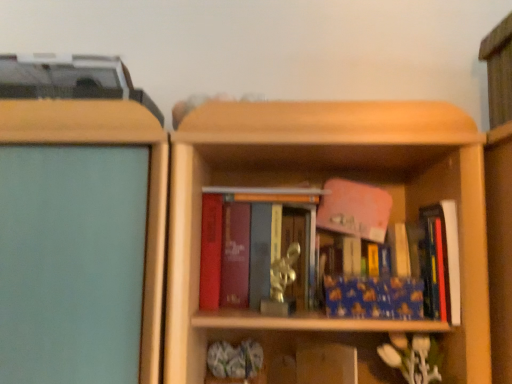
Question: Is blue matte book at center, the 2th book positioned from the left, far away from matte red book at center, which is the first book in left-to-right order?

Choices:
 (A) yes
 (B) no

Answer: (B)

Question: Is blue matte book at center, the 2th book positioned from the left, wider than matte red book at center, which is the first book in left-to-right order?

Choices:
 (A) no
 (B) yes

Answer: (A)

Question: Does blue matte book at center, which appears as the second book when viewed from the right, appear on the right side of matte red book at center, which is counted as the 3th book, starting from the right?

Choices:
 (A) yes
 (B) no

Answer: (A)

Question: From a real-world perspective, is blue matte book at center, the 2th book positioned from the left, below matte red book at center, which is counted as the 3th book, starting from the right?

Choices:
 (A) yes
 (B) no

Answer: (A)

Question: Is blue matte book at center, the 2th book positioned from the left, next to matte red book at center, which is the first book in left-to-right order, and touching it?

Choices:
 (A) no
 (B) yes

Answer: (A)

Question: From a real-world perspective, is matte red book at center, which is the first book in left-to-right order, above or below blue matte book at right, marked as the 1th book in a right-to-left arrangement?

Choices:
 (A) below
 (B) above

Answer: (B)

Question: Looking at the image, does matte red book at center, which is the first book in left-to-right order, seem bigger or smaller compared to blue matte book at right, the third book in the left-to-right sequence?

Choices:
 (A) big
 (B) small

Answer: (A)

Question: Does point (233, 243) appear closer or farther from the camera than point (455, 248)?

Choices:
 (A) farther
 (B) closer

Answer: (A)

Question: From the image's perspective, is matte red book at center, which is counted as the 3th book, starting from the right, positioned above or below blue matte book at right, marked as the 1th book in a right-to-left arrangement?

Choices:
 (A) above
 (B) below

Answer: (A)

Question: Is matte red book at center, which is counted as the 3th book, starting from the right, wider or thinner than blue matte book at center, which appears as the second book when viewed from the right?

Choices:
 (A) thin
 (B) wide

Answer: (B)

Question: Choose the correct answer: Is matte red book at center, which is counted as the 3th book, starting from the right, inside blue matte book at center, the 2th book positioned from the left, or outside it?

Choices:
 (A) outside
 (B) inside

Answer: (A)

Question: In terms of height, does matte red book at center, which is counted as the 3th book, starting from the right, look taller or shorter compared to blue matte book at center, which appears as the second book when viewed from the right?

Choices:
 (A) tall
 (B) short

Answer: (A)

Question: Based on their positions, is matte red book at center, which is counted as the 3th book, starting from the right, located to the left or right of blue matte book at center, which appears as the second book when viewed from the right?

Choices:
 (A) left
 (B) right

Answer: (A)

Question: From the image's perspective, is blue matte book at center, the 2th book positioned from the left, located above or below matte red book at center, which is counted as the 3th book, starting from the right?

Choices:
 (A) above
 (B) below

Answer: (B)

Question: Considering their positions, is blue matte book at center, the 2th book positioned from the left, located in front of or behind matte red book at center, which is counted as the 3th book, starting from the right?

Choices:
 (A) behind
 (B) front

Answer: (B)